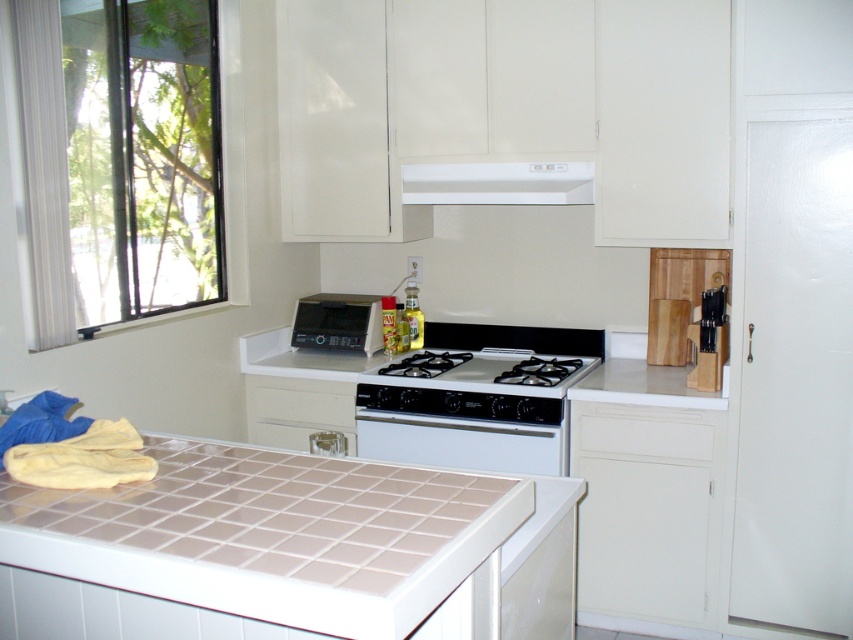
Is white glossy oven at center smaller than matte black microwave at center?

Correct, white glossy oven at center occupies less space than matte black microwave at center.

Is point (509, 470) farther from viewer compared to point (300, 307)?

That is False.

Does point (398, 419) lie in front of point (294, 340)?

Yes, point (398, 419) is in front of point (294, 340).

You are a GUI agent. You are given a task and a screenshot of the screen. Output one action in this format:
    pyautogui.click(x=<x>, y=<y>)
    Task: Click on the white glossy oven at center
    The image size is (853, 640).
    Given the screenshot: What is the action you would take?
    [460, 442]

Can you confirm if clear glass window at upper left is shorter than matte black microwave at center?

In fact, clear glass window at upper left may be taller than matte black microwave at center.

Does point (192, 45) come farther from viewer compared to point (366, 339)?

That is False.

The width and height of the screenshot is (853, 640). I want to click on clear glass window at upper left, so click(128, 170).

Is white matte exhaust hood at upper center smaller than white glossy gas stove at center?

Indeed, white matte exhaust hood at upper center has a smaller size compared to white glossy gas stove at center.

Does white matte exhaust hood at upper center have a lesser width compared to white glossy gas stove at center?

Yes.

Is point (521, 193) positioned after point (537, 364)?

No, it is in front of (537, 364).

Identify the location of white matte exhaust hood at upper center. (497, 182).